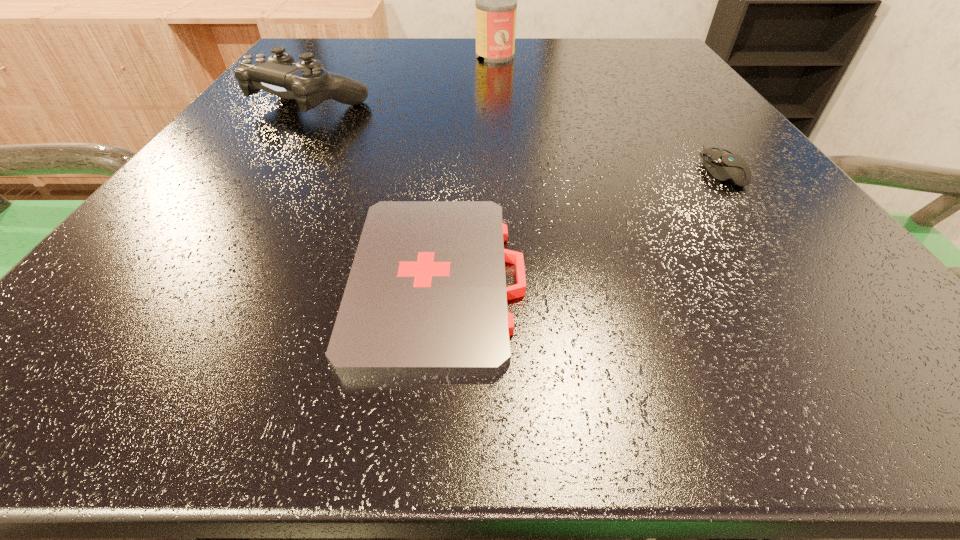
I want to click on can, so click(x=496, y=0).

The width and height of the screenshot is (960, 540). I want to click on the tallest object, so click(496, 0).

Locate an element on the screen. the third shortest object is located at coordinates (306, 81).

Where is `the third nearest object`? The image size is (960, 540). the third nearest object is located at coordinates (306, 81).

Image resolution: width=960 pixels, height=540 pixels. I want to click on the third farthest object, so click(724, 165).

Where is `computer mouse`? This screenshot has width=960, height=540. computer mouse is located at coordinates (724, 165).

What are the coordinates of `the first-aid kit` in the screenshot? It's located at (426, 295).

Where is `the nearest object`? This screenshot has width=960, height=540. the nearest object is located at coordinates (426, 295).

Where is `free space located 0.290m on the right of the tallest object`? This screenshot has width=960, height=540. free space located 0.290m on the right of the tallest object is located at coordinates point(650,56).

Find the location of a particular element. This screenshot has width=960, height=540. free region located on the front of the control is located at coordinates (205, 268).